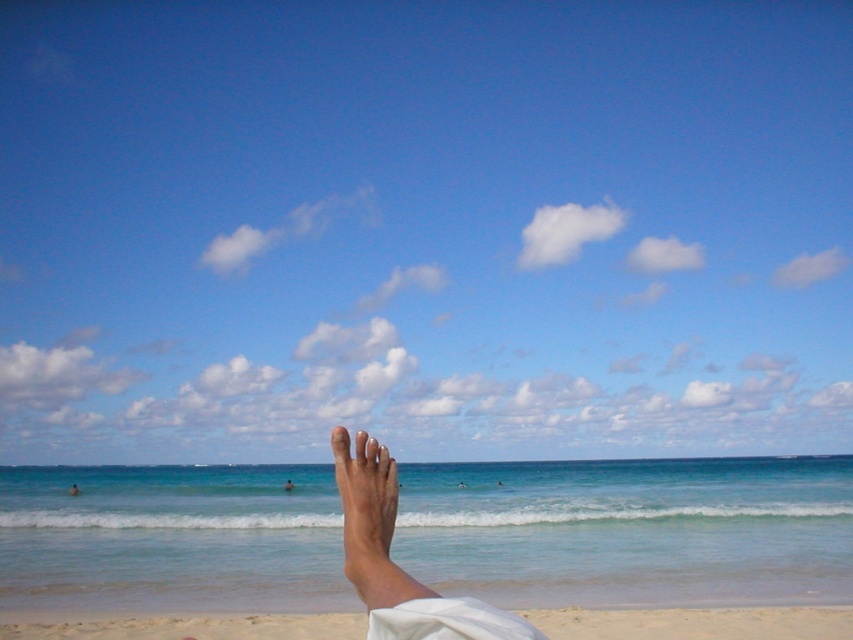
Question: Which point is farther to the camera?

Choices:
 (A) white matte foot at center
 (B) white sandy beach at lower center

Answer: (B)

Question: Can you confirm if white sandy beach at lower center is positioned to the left of white matte foot at center?

Choices:
 (A) no
 (B) yes

Answer: (A)

Question: Which of the following is the farthest from the observer?

Choices:
 (A) (401, 596)
 (B) (345, 637)

Answer: (B)

Question: Which point is farther to the camera?

Choices:
 (A) (431, 593)
 (B) (630, 628)

Answer: (B)

Question: Observing the image, what is the correct spatial positioning of white sandy beach at lower center in reference to white matte foot at center?

Choices:
 (A) right
 (B) left

Answer: (A)

Question: Can you confirm if white sandy beach at lower center is positioned to the left of white matte foot at center?

Choices:
 (A) yes
 (B) no

Answer: (B)